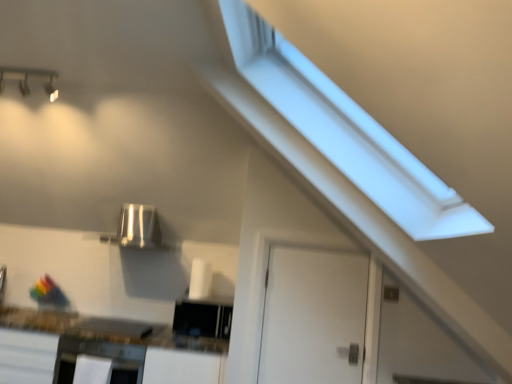
At what (x,y) coordinates should I click in order to perform the action: click on vacant space situated above matte silver light fixture at upper left (from a real-world perspective). Please return your answer as a coordinate pair (x, y). This screenshot has width=512, height=384. Looking at the image, I should click on (24, 68).